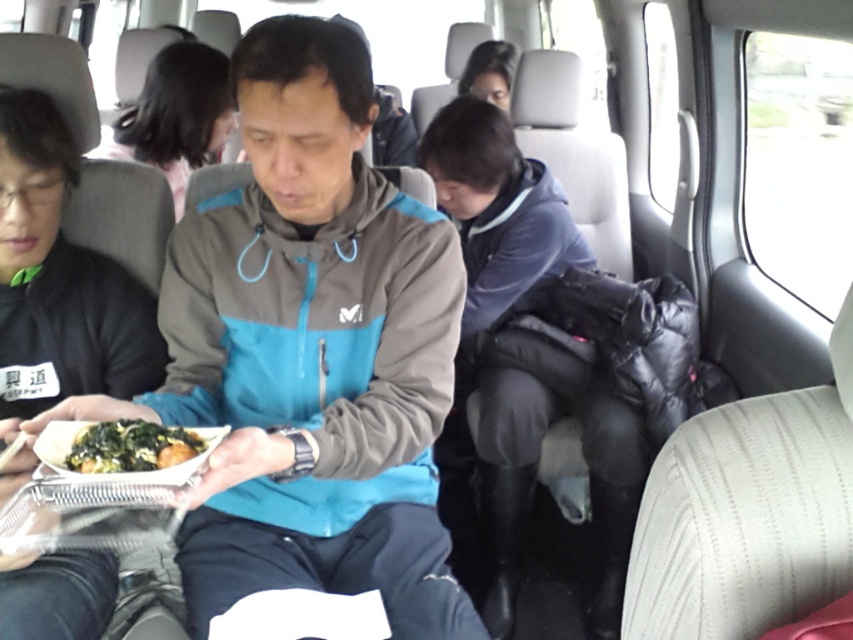
You are a passenger in the vehicle and want to know if the black matte hair at upper center is wider than the green leafy vegetables at center. Can you determine this based on the scene?

The black matte hair at upper center is wider than the green leafy vegetables at center according to the description.